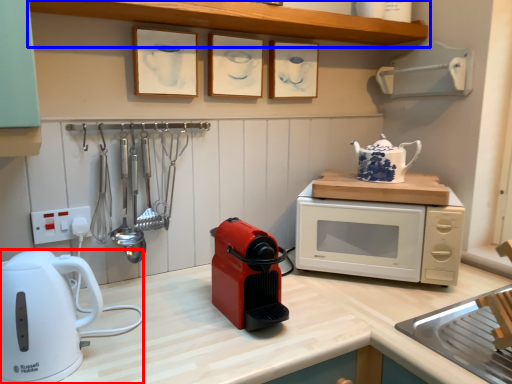
Question: Which point is further to the camera, home appliance (highlighted by a red box) or shelf (highlighted by a blue box)?

Choices:
 (A) home appliance
 (B) shelf

Answer: (B)